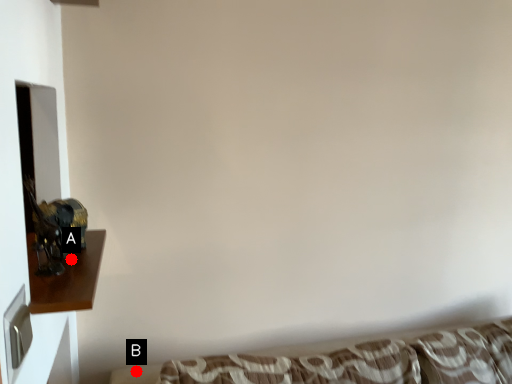
Question: Two points are circled on the image, labeled by A and B beside each circle. Which point appears closest to the camera in this image?

Choices:
 (A) A is closer
 (B) B is closer

Answer: (A)